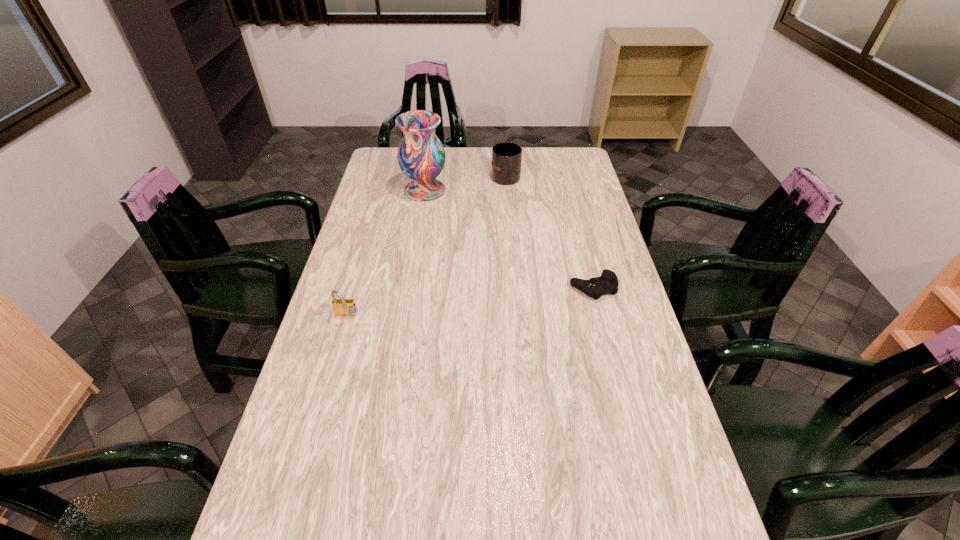
Identify the location of blank region between the third object from right to left and the third shortest object. (466, 183).

The width and height of the screenshot is (960, 540). Find the location of `free space between the second object from right to left and the third tallest object`. free space between the second object from right to left and the third tallest object is located at coordinates (426, 246).

Choose which object is the third nearest neighbor to the vase. Please provide its 2D coordinates. Your answer should be formatted as a tuple, i.e. [(x, y)], where the tuple contains the x and y coordinates of a point satisfying the conditions above.

[(607, 283)]

In order to click on object that is the second closest one to the leftmost object in this screenshot , I will do `click(607, 283)`.

Where is `vacant area in the image that satisfies the following two spatial constraints: 1. on the front side of the second object from left to right; 2. on the right side of the second nearest object`? vacant area in the image that satisfies the following two spatial constraints: 1. on the front side of the second object from left to right; 2. on the right side of the second nearest object is located at coordinates (409, 287).